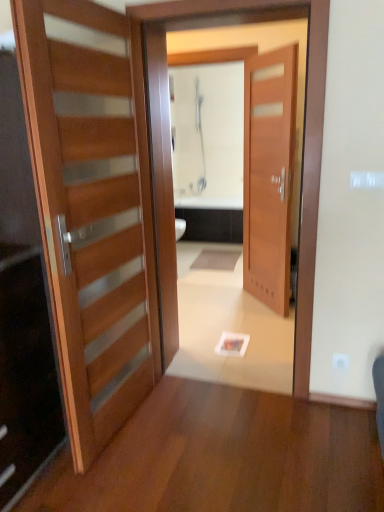
The height and width of the screenshot is (512, 384). What are the coordinates of `free space in front of wooden door at center, acting as the 2th door starting from the left` in the screenshot? It's located at (256, 322).